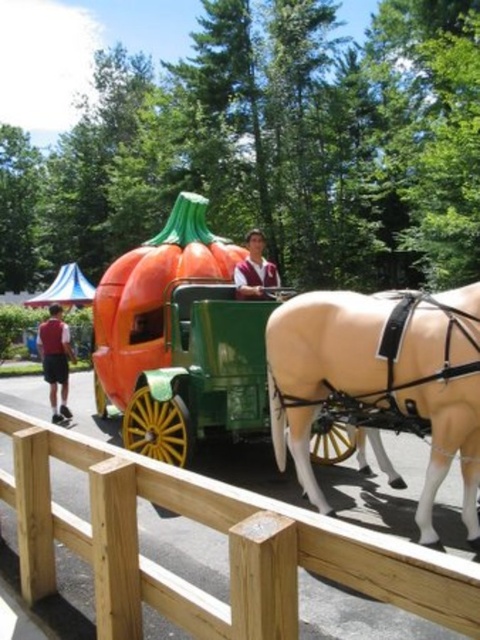
Question: Which point is closer to the camera?

Choices:
 (A) (239, 266)
 (B) (432, 435)
 (C) (64, 401)

Answer: (B)

Question: Which object is positioned closest to the tan matte horse at center?

Choices:
 (A) matte brown vest at center
 (B) matte red shorts at lower left

Answer: (A)

Question: Is tan matte horse at center further to the viewer compared to matte red shorts at lower left?

Choices:
 (A) no
 (B) yes

Answer: (A)

Question: Estimate the real-world distances between objects in this image. Which object is farther from the matte brown vest at center?

Choices:
 (A) tan matte horse at center
 (B) matte red shorts at lower left

Answer: (B)

Question: Is the position of tan matte horse at center less distant than that of matte brown vest at center?

Choices:
 (A) yes
 (B) no

Answer: (A)

Question: Is tan matte horse at center thinner than matte brown vest at center?

Choices:
 (A) yes
 (B) no

Answer: (B)